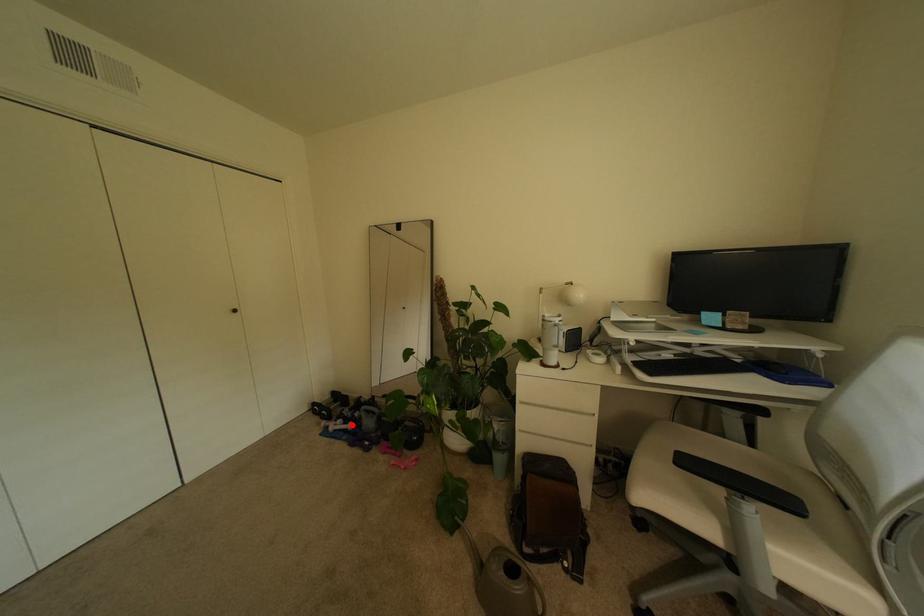
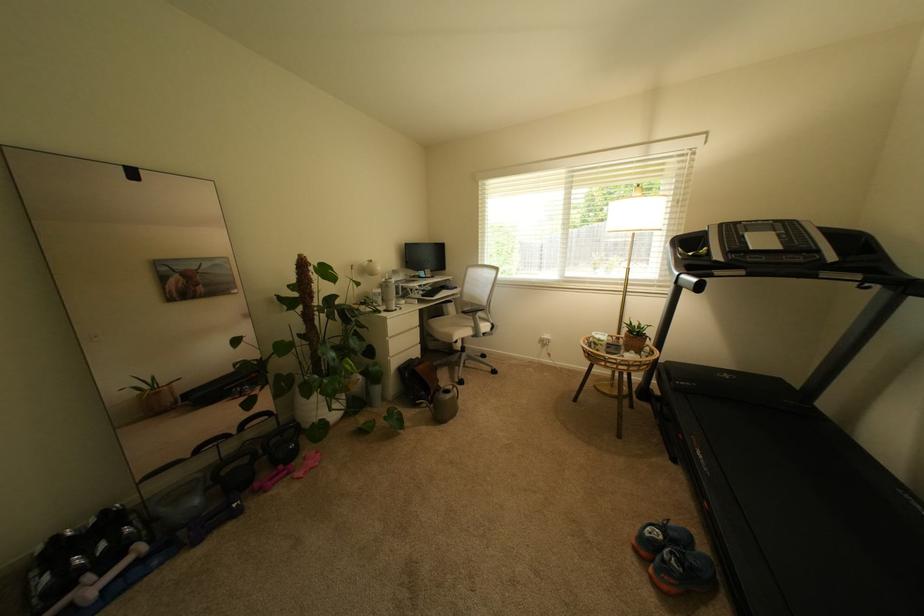
Where in the second image is the point corresponding to the highlighted location from the first image?

(111, 573)